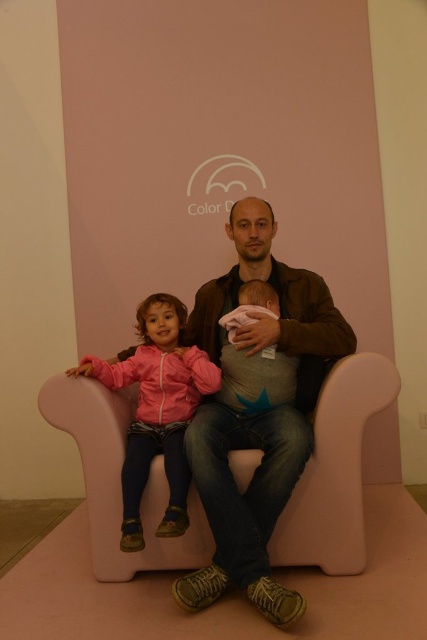
Question: Among these points, which one is farthest from the camera?

Choices:
 (A) (170, 385)
 (B) (271, 307)

Answer: (A)

Question: Can you confirm if pink matte jacket at center is bigger than soft pink fabric baby at center?

Choices:
 (A) no
 (B) yes

Answer: (B)

Question: Does pink matte jacket at center have a greater width compared to soft pink fabric baby at center?

Choices:
 (A) yes
 (B) no

Answer: (A)

Question: Which object appears farthest from the camera in this image?

Choices:
 (A) pink foam armchair at center
 (B) brown leather jacket at center
 (C) pink matte jacket at center

Answer: (A)

Question: Does brown leather jacket at center come in front of pink foam armchair at center?

Choices:
 (A) yes
 (B) no

Answer: (A)

Question: Which object appears closest to the camera in this image?

Choices:
 (A) pink foam armchair at center
 (B) soft pink fabric baby at center

Answer: (A)